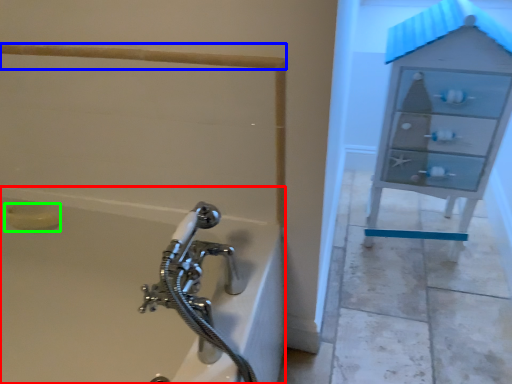
Question: Which is farther away from bathtub (highlighted by a red box)? rail (highlighted by a blue box) or soap (highlighted by a green box)?

Choices:
 (A) rail
 (B) soap

Answer: (A)